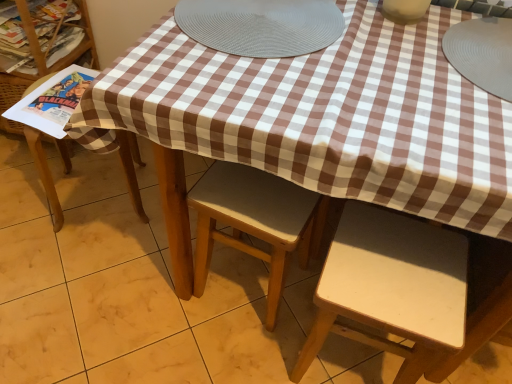
Locate an element on the screen. This screenshot has width=512, height=384. vacant location below wooden chair at left, which ranks as the third chair in right-to-left order (from a real-world perspective) is located at coordinates (95, 198).